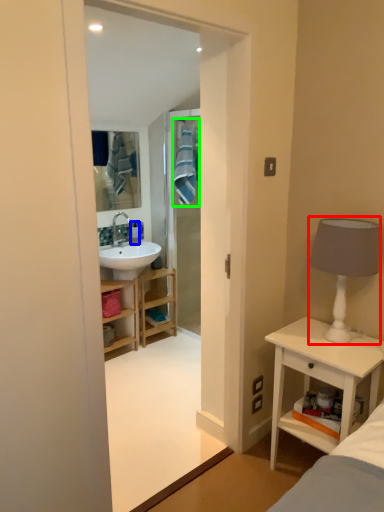
Question: Considering the real-world distances, which object is closest to table lamp (highlighted by a red box)? toiletry (highlighted by a blue box) or bath towel (highlighted by a green box).

Choices:
 (A) toiletry
 (B) bath towel

Answer: (B)